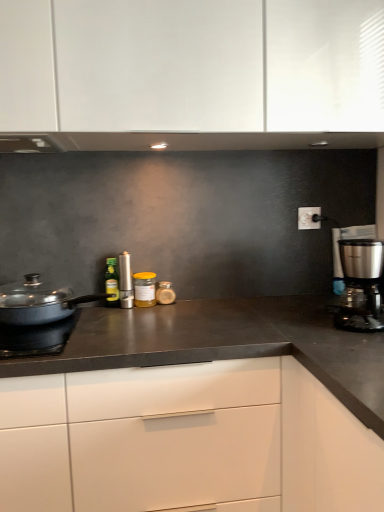
Question: Which is correct: translucent glass jar at center, marked as the fourth kitchen appliance in a left-to-right arrangement, is inside white matte cabinet at center, or outside of it?

Choices:
 (A) outside
 (B) inside

Answer: (A)

Question: Does point (160, 284) appear closer or farther from the camera than point (190, 500)?

Choices:
 (A) closer
 (B) farther

Answer: (B)

Question: Which object is the farthest from the yellow glass jar at center, which ranks as the 3th kitchen appliance in left-to-right order?

Choices:
 (A) matte black pan at left
 (B) satin silver canister at center, the fourth kitchen appliance viewed from the right
 (C) matte black pan at left
 (D) white matte cabinet at center
 (E) green glass bottle at center, the 2th kitchen appliance in the back-to-front sequence

Answer: (D)

Question: Estimate the real-world distances between objects in this image. Which object is farther from the matte black pan at left?

Choices:
 (A) satin silver canister at center, the fourth kitchen appliance viewed from the right
 (B) yellow glass jar at center, which ranks as the 3th kitchen appliance in left-to-right order
 (C) white matte cabinet at center
 (D) satin silver coffee maker at right, the fifth kitchen appliance positioned from the left
 (E) green glass bottle at center, the 2th kitchen appliance in the back-to-front sequence

Answer: (D)